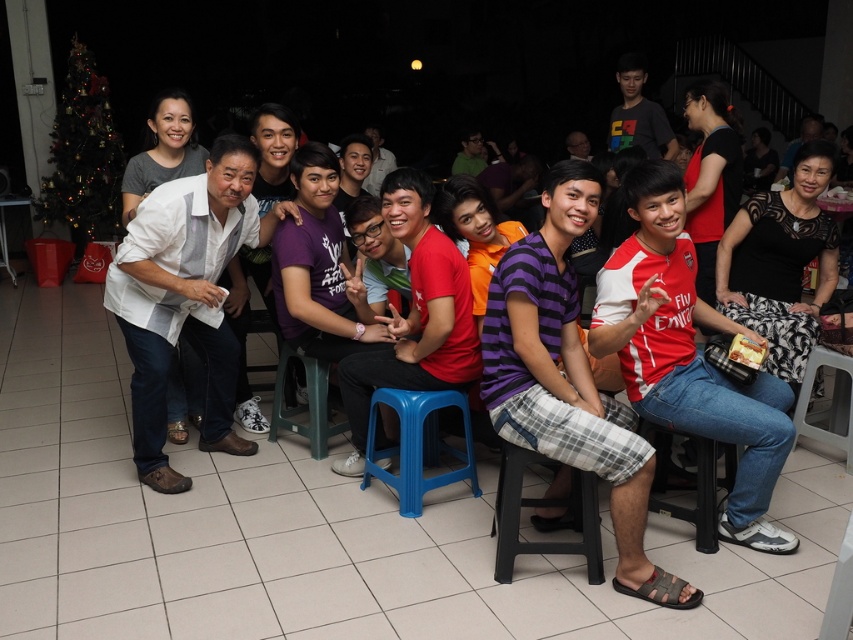
You are a photographer trying to capture a group photo. You notice the black plastic stool at lower center and the green plastic stool at center. Which stool is directly above the other?

The green plastic stool at center is directly above the black plastic stool at lower center because the black plastic stool at lower center is positioned under the green plastic stool at center.

You are organizing a small event and need to seat two guests. You have a black plastic stool at lower center and a plastic stool at lower right available. Which stool would you choose if you want the larger one for comfort?

The plastic stool at lower right is larger than the black plastic stool at lower center, so you should choose the plastic stool at lower right for comfort.

You are at a Christmas party and want to sit on the stool closest to the Christmas tree. Which stool should you choose between the blue plastic stool at center and the plastic stool at lower right?

The blue plastic stool at center is to the left of the plastic stool at lower right. Since the Christmas tree is on the left side of the frame, the blue plastic stool at center is closer to the Christmas tree.